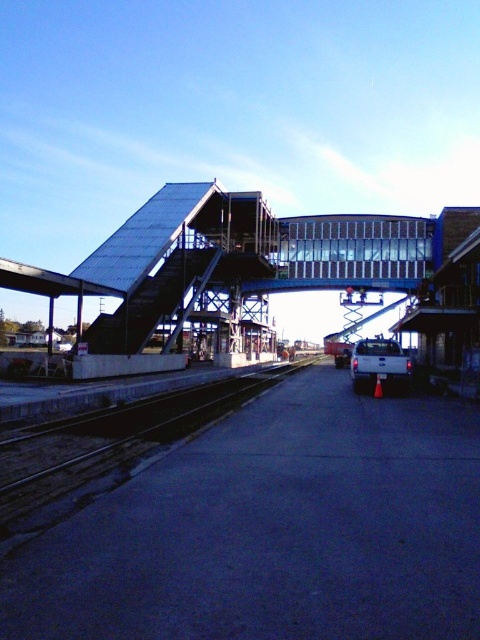
Question: Does metallic gray platform at center lie behind dark gray concrete train track at center?

Choices:
 (A) no
 (B) yes

Answer: (B)

Question: Does metallic gray platform at center appear under dark gray concrete train track at center?

Choices:
 (A) no
 (B) yes

Answer: (A)

Question: Which of the following is the closest to the observer?

Choices:
 (A) (405, 250)
 (B) (184, 392)

Answer: (B)

Question: Does metallic gray platform at center lie in front of dark gray concrete train track at center?

Choices:
 (A) yes
 (B) no

Answer: (B)

Question: Which of the following is the closest to the observer?

Choices:
 (A) metallic gray platform at center
 (B) dark gray concrete train track at center

Answer: (B)